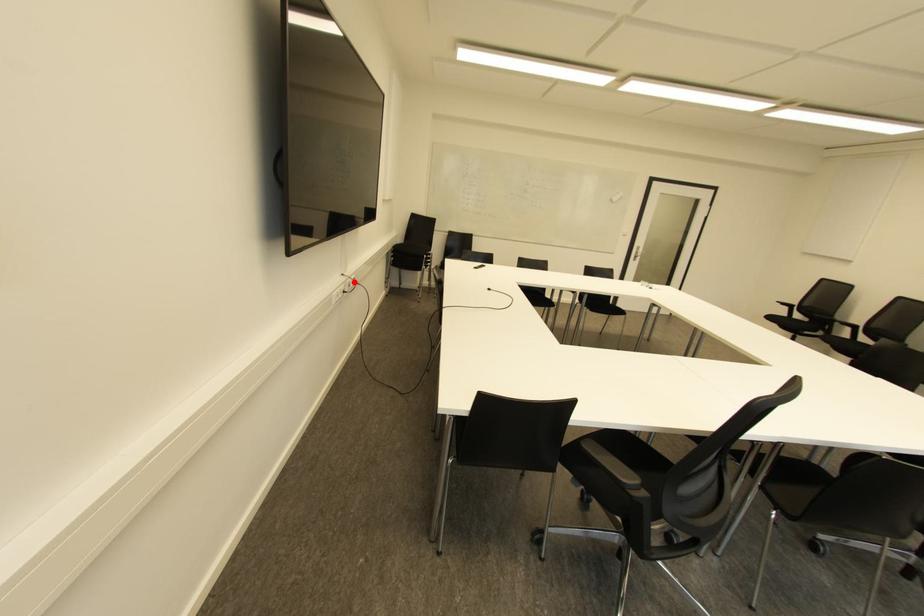
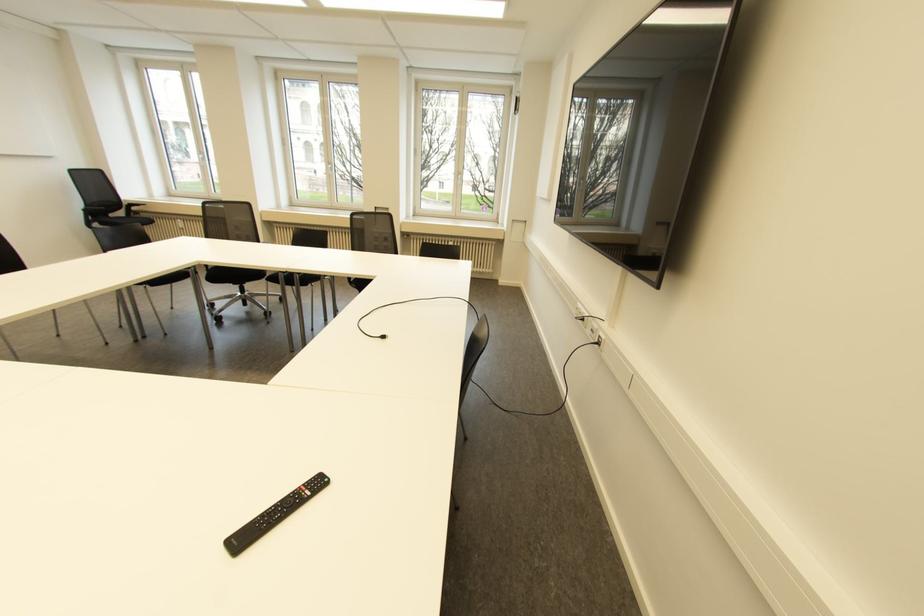
Find the pixel in the second image that matches the highlighted location in the first image.

(598, 342)